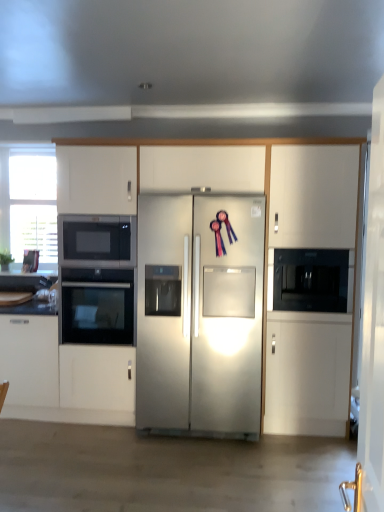
Question: Is black glass oven at left, the 1th oven from the top, inside or outside of black glass oven at left, marked as the first oven in a bottom-to-top arrangement?

Choices:
 (A) outside
 (B) inside

Answer: (A)

Question: Based on their sizes in the image, would you say black glass oven at left, which is counted as the 2th oven, starting from the bottom, is bigger or smaller than black glass oven at left, marked as the first oven in a bottom-to-top arrangement?

Choices:
 (A) small
 (B) big

Answer: (A)

Question: Which object is the farthest from the black matte microwave oven at right?

Choices:
 (A) stainless steel refrigerator at center
 (B) white glossy door at right
 (C) black glass oven at left, acting as the second oven starting from the top
 (D) white glossy countertop at lower left
 (E) black glass oven at left, which is counted as the 2th oven, starting from the bottom

Answer: (D)

Question: Based on their relative distances, which object is farther from the transparent glass window at left?

Choices:
 (A) black glass oven at left, acting as the second oven starting from the top
 (B) satin white cabinets at center
 (C) white glossy door at right
 (D) black matte microwave oven at right
 (E) black glass oven at left, which is counted as the 2th oven, starting from the bottom

Answer: (C)